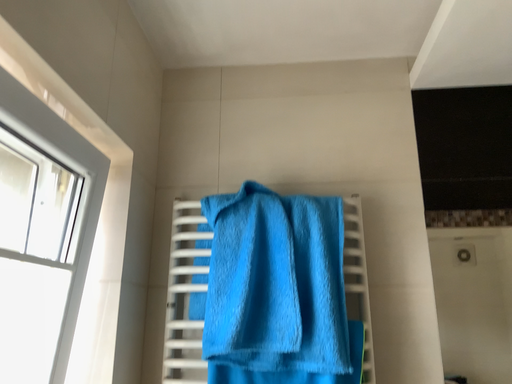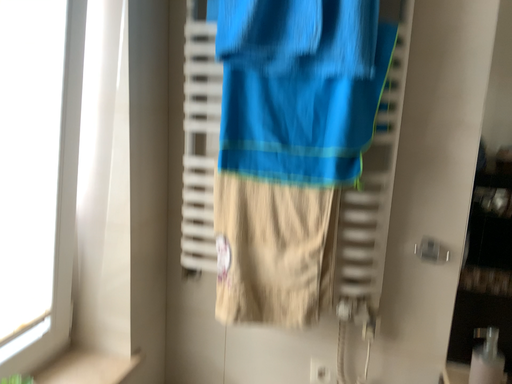
Question: How did the camera likely rotate when shooting the video?

Choices:
 (A) rotated right
 (B) rotated left

Answer: (B)